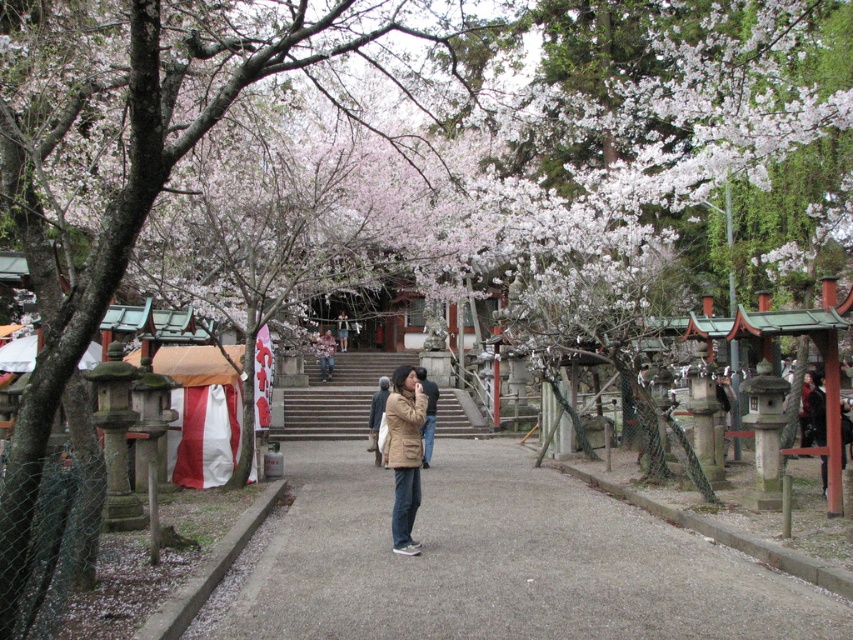
You are a visitor at the shrine and want to know which jacket is shorter between the brown matte jacket at center and the brown leather jacket at center. Which one is shorter?

The brown matte jacket at center is shorter than the brown leather jacket at center.